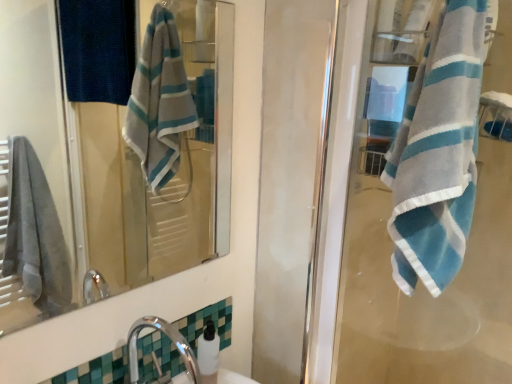
Question: Does chrome metallic faucet at lower left have a greater height compared to white glossy soap dispenser at lower center?

Choices:
 (A) yes
 (B) no

Answer: (A)

Question: From the image's perspective, would you say chrome metallic faucet at lower left is positioned over white glossy soap dispenser at lower center?

Choices:
 (A) yes
 (B) no

Answer: (B)

Question: Is chrome metallic faucet at lower left positioned before white glossy soap dispenser at lower center?

Choices:
 (A) no
 (B) yes

Answer: (B)

Question: From the image's perspective, is chrome metallic faucet at lower left located beneath white glossy soap dispenser at lower center?

Choices:
 (A) no
 (B) yes

Answer: (B)

Question: Does chrome metallic faucet at lower left have a lesser width compared to white glossy soap dispenser at lower center?

Choices:
 (A) no
 (B) yes

Answer: (A)

Question: From the image's perspective, is blue striped towel at right positioned above or below matte glass mirror at upper center?

Choices:
 (A) below
 (B) above

Answer: (A)

Question: Is blue striped towel at right in front of or behind matte glass mirror at upper center in the image?

Choices:
 (A) behind
 (B) front

Answer: (B)

Question: Is blue striped towel at right wider or thinner than matte glass mirror at upper center?

Choices:
 (A) thin
 (B) wide

Answer: (B)

Question: Is blue striped towel at right situated inside matte glass mirror at upper center or outside?

Choices:
 (A) outside
 (B) inside

Answer: (A)

Question: Considering the relative positions of chrome metallic faucet at lower left and white glossy soap dispenser at lower center in the image provided, is chrome metallic faucet at lower left to the left or to the right of white glossy soap dispenser at lower center?

Choices:
 (A) left
 (B) right

Answer: (A)

Question: Would you say chrome metallic faucet at lower left is inside or outside white glossy soap dispenser at lower center?

Choices:
 (A) inside
 (B) outside

Answer: (B)

Question: Is chrome metallic faucet at lower left taller or shorter than white glossy soap dispenser at lower center?

Choices:
 (A) short
 (B) tall

Answer: (B)

Question: Based on their sizes in the image, would you say chrome metallic faucet at lower left is bigger or smaller than white glossy soap dispenser at lower center?

Choices:
 (A) big
 (B) small

Answer: (A)

Question: Is chrome metallic faucet at lower left bigger or smaller than matte glass mirror at upper center?

Choices:
 (A) big
 (B) small

Answer: (A)

Question: Is chrome metallic faucet at lower left in front of or behind matte glass mirror at upper center in the image?

Choices:
 (A) front
 (B) behind

Answer: (B)